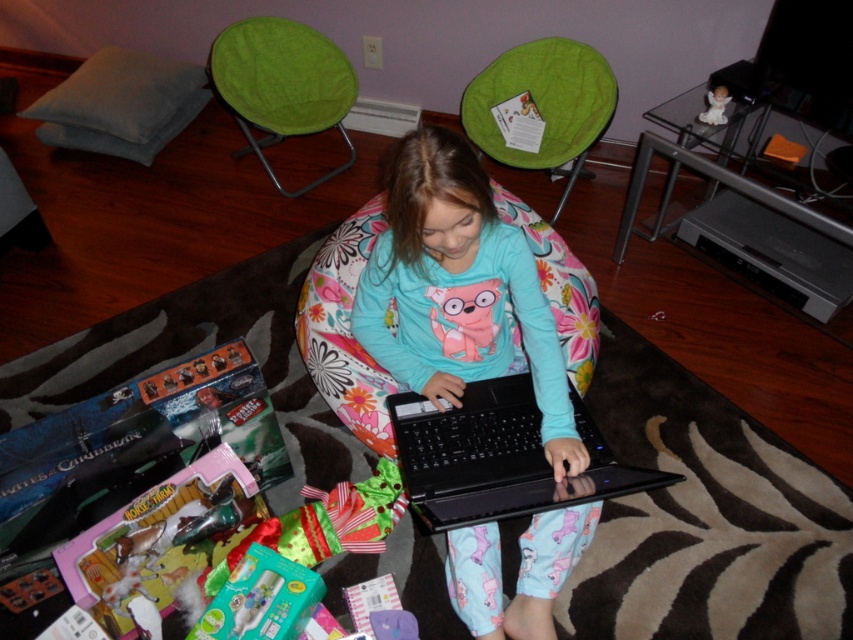
In the scene shown: Does floral fabric bean bag at center have a larger size compared to teal plastic toothbrush at lower center?

Yes.

Between floral fabric bean bag at center and teal plastic toothbrush at lower center, which one appears on the right side from the viewer's perspective?

Positioned to the right is floral fabric bean bag at center.

Describe the element at coordinates (345, 330) in the screenshot. Image resolution: width=853 pixels, height=640 pixels. I see `floral fabric bean bag at center` at that location.

Where is `floral fabric bean bag at center`? floral fabric bean bag at center is located at coordinates (345, 330).

Can you confirm if black plastic laptop at center is taller than white porcelain angel at upper right?

Yes.

Consider the image. Can you confirm if black plastic laptop at center is bigger than white porcelain angel at upper right?

Yes.

Is point (479, 424) positioned behind point (703, 115)?

No, it is not.

Where is `black plastic laptop at center`? black plastic laptop at center is located at coordinates (498, 456).

Image resolution: width=853 pixels, height=640 pixels. What do you see at coordinates (498, 456) in the screenshot? I see `black plastic laptop at center` at bounding box center [498, 456].

Is black plastic laptop at center above teal plastic toothbrush at lower center?

Correct, black plastic laptop at center is located above teal plastic toothbrush at lower center.

Describe the element at coordinates (498, 456) in the screenshot. I see `black plastic laptop at center` at that location.

Find the location of a particular element. This screenshot has height=640, width=853. black plastic laptop at center is located at coordinates (498, 456).